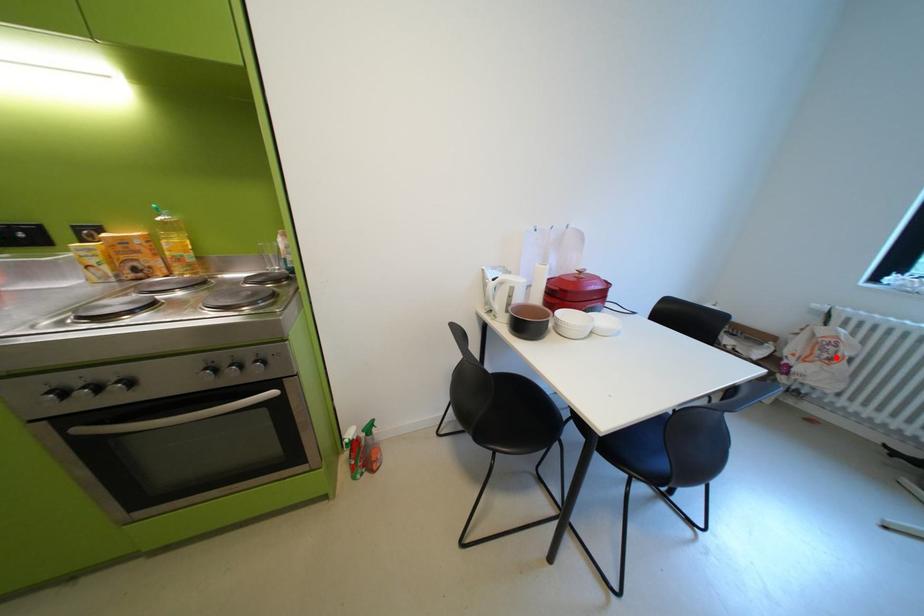
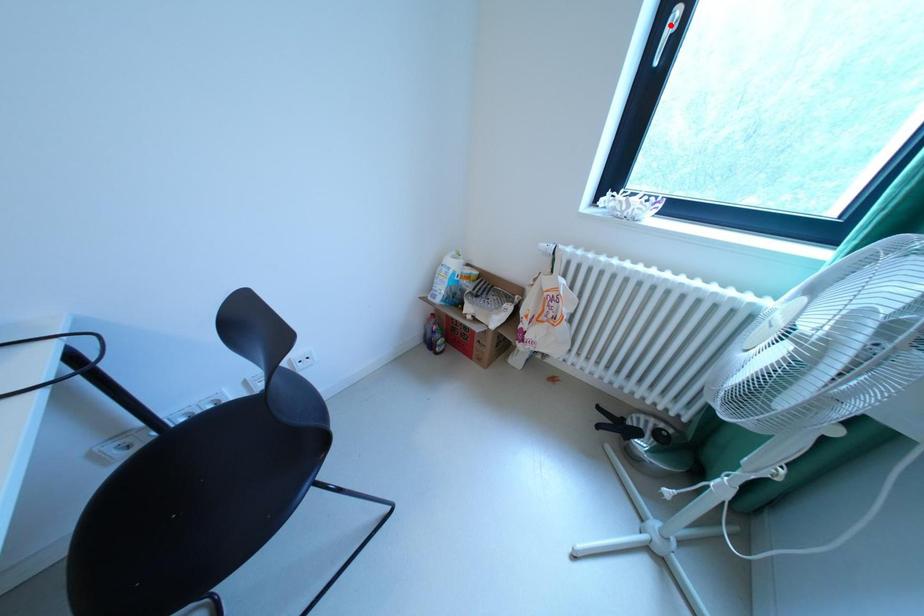
I am providing you with two images of the same scene from different viewpoints. A red point is marked on the first image and another point is marked on the second image. Is the red point in image1 aligned with the point shown in image2?

No